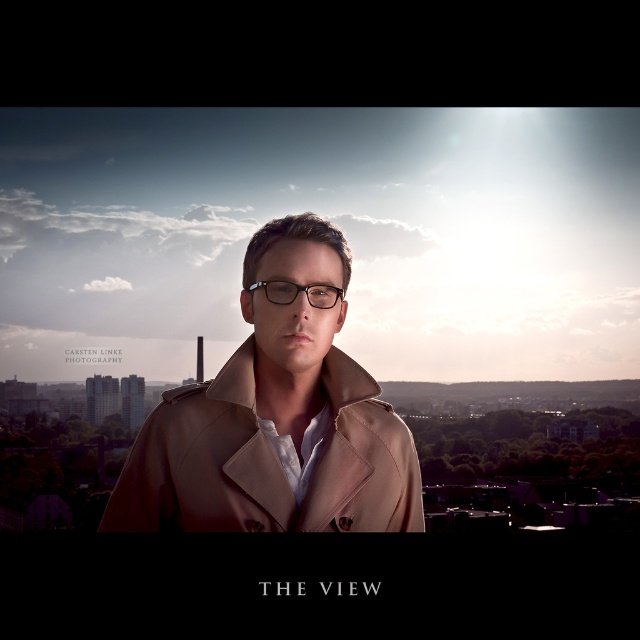
Question: Can you confirm if tan leather trench coat at center is thinner than matte black glasses at center?

Choices:
 (A) no
 (B) yes

Answer: (A)

Question: Observing the image, what is the correct spatial positioning of tan leather trench coat at center in reference to matte black glasses at center?

Choices:
 (A) right
 (B) left

Answer: (B)

Question: Does tan leather trench coat at center have a larger size compared to matte black glasses at center?

Choices:
 (A) yes
 (B) no

Answer: (A)

Question: Which of the following is the farthest from the observer?

Choices:
 (A) (340, 294)
 (B) (221, 483)

Answer: (A)